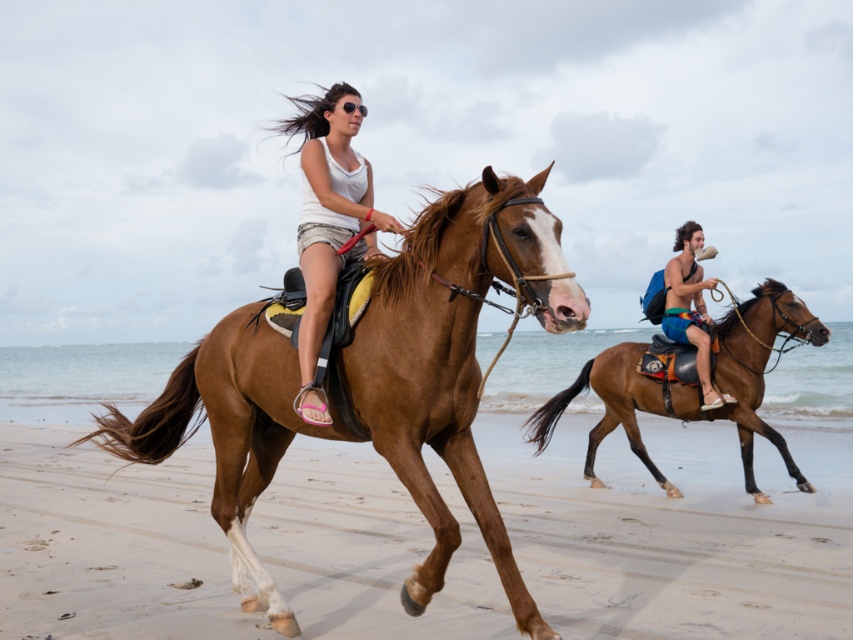
Question: Which of the following is the farthest from the observer?

Choices:
 (A) blue fabric shorts at center
 (B) matte white tank top at center

Answer: (A)

Question: Does brown glossy horse at right have a lesser width compared to matte white tank top at center?

Choices:
 (A) yes
 (B) no

Answer: (B)

Question: In this image, where is brown glossy horse at left located relative to matte white tank top at center?

Choices:
 (A) below
 (B) above

Answer: (A)

Question: Based on their relative distances, which object is farther from the brown sand at lower center?

Choices:
 (A) blue fabric backpack at right
 (B) matte white tank top at center

Answer: (B)

Question: Which object is positioned farthest from the brown sand at lower center?

Choices:
 (A) brown glossy horse at left
 (B) matte white tank top at center

Answer: (B)

Question: Is the position of brown sand at lower center more distant than that of brown glossy horse at right?

Choices:
 (A) yes
 (B) no

Answer: (B)